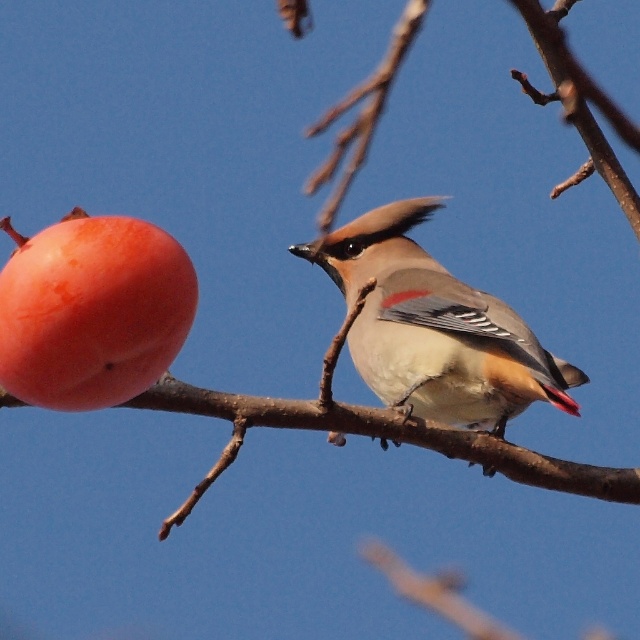
Based on the photo, does matte gray bird at center appear on the right side of smooth orange persimmon at left?

Yes, matte gray bird at center is to the right of smooth orange persimmon at left.

Can you confirm if matte gray bird at center is thinner than smooth orange persimmon at left?

No.

Is point (524, 349) closer to viewer compared to point (48, 328)?

No.

Locate an element on the screen. Image resolution: width=640 pixels, height=640 pixels. matte gray bird at center is located at coordinates (435, 328).